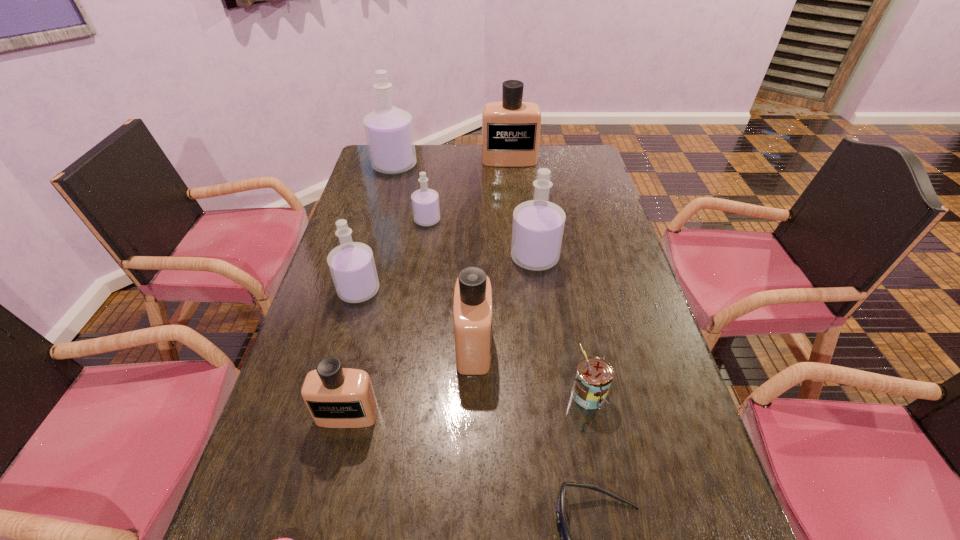
Find the location of a particular element. The width and height of the screenshot is (960, 540). the tallest object is located at coordinates (389, 132).

Identify the location of the biggest purple perfume. (389, 132).

At what (x,y) coordinates should I click in order to perform the action: click on the biggest beige perfume. Please return your answer as a coordinate pair (x, y). Looking at the image, I should click on (510, 128).

Find the location of a particular element. This screenshot has width=960, height=540. the rightmost purple perfume is located at coordinates (538, 225).

Find the location of a particular element. This screenshot has height=540, width=960. the second nearest purple perfume is located at coordinates (538, 225).

Find the location of a particular element. The width and height of the screenshot is (960, 540). the nearest purple perfume is located at coordinates (352, 266).

Locate an element on the screen. This screenshot has height=540, width=960. the third nearest perfume is located at coordinates (352, 266).

Identify the location of the second smallest beige perfume. Image resolution: width=960 pixels, height=540 pixels. (472, 308).

I want to click on the second nearest perfume, so click(472, 308).

Identify the location of the fifth object from left to right. This screenshot has height=540, width=960. (425, 202).